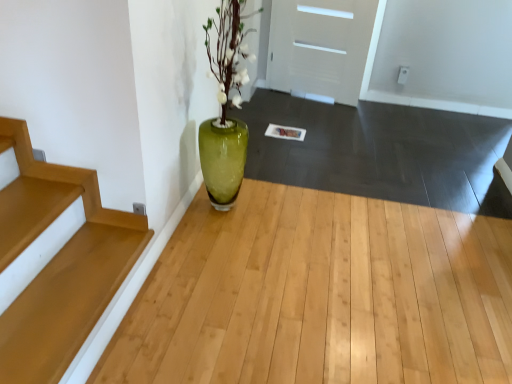
Where is `green glass vase at center`? The width and height of the screenshot is (512, 384). green glass vase at center is located at coordinates (320, 295).

Image resolution: width=512 pixels, height=384 pixels. What do you see at coordinates (320, 47) in the screenshot? I see `white matte door at upper center` at bounding box center [320, 47].

The width and height of the screenshot is (512, 384). I want to click on wooden stairs at lower left, so click(x=58, y=262).

How many degrees apart are the facing directions of wooden stairs at lower left and white matte door at upper center?

The facing directions of wooden stairs at lower left and white matte door at upper center are 113 degrees apart.

Based on their positions, is wooden stairs at lower left located to the left or right of white matte door at upper center?

Based on their positions, wooden stairs at lower left is located to the left of white matte door at upper center.

The width and height of the screenshot is (512, 384). I want to click on door behind the wooden stairs at lower left, so click(x=320, y=47).

Would you say wooden stairs at lower left is inside or outside white matte door at upper center?

wooden stairs at lower left is not inside white matte door at upper center, it's outside.

Consider the image. From a real-world perspective, is white matte door at upper center below green glass vase at center?

No.

Can green glass vase at center be found inside white matte door at upper center?

No, green glass vase at center is located outside of white matte door at upper center.

Can you confirm if white matte door at upper center is taller than green glass vase at center?

Correct, white matte door at upper center is much taller as green glass vase at center.

Considering the sizes of objects white matte door at upper center and green glass vase at center in the image provided, who is thinner, white matte door at upper center or green glass vase at center?

white matte door at upper center is thinner.

Can you tell me how much white matte door at upper center and wooden stairs at lower left differ in facing direction?

113 degrees.

Would you say wooden stairs at lower left is part of white matte door at upper center's contents?

No, wooden stairs at lower left is not a part of white matte door at upper center.

Are white matte door at upper center and wooden stairs at lower left making contact?

No, white matte door at upper center is not touching wooden stairs at lower left.

Considering the relative positions of white matte door at upper center and wooden stairs at lower left in the image provided, is white matte door at upper center to the left or to the right of wooden stairs at lower left?

white matte door at upper center is positioned on wooden stairs at lower left's right side.

Relative to wooden stairs at lower left, is green glass vase at center in front or behind?

green glass vase at center is positioned closer to the viewer than wooden stairs at lower left.

Can you confirm if green glass vase at center is positioned to the right of wooden stairs at lower left?

Yes, green glass vase at center is to the right of wooden stairs at lower left.

Which is farther, (441, 328) or (86, 209)?

Positioned behind is point (86, 209).

Choose the correct answer: Is green glass vase at center inside wooden stairs at lower left or outside it?

green glass vase at center lies outside wooden stairs at lower left.

In the image, is wooden stairs at lower left on the left side or the right side of green glass vase at center?

wooden stairs at lower left is to the left of green glass vase at center.

Looking at this image, from a real-world perspective, is wooden stairs at lower left positioned under green glass vase at center based on gravity?

No, from a real-world perspective, wooden stairs at lower left is not under green glass vase at center.

Considering the positions of points (99, 311) and (199, 363), is point (99, 311) closer to camera compared to point (199, 363)?

Yes, it is.

Who is smaller, wooden stairs at lower left or green glass vase at center?

wooden stairs at lower left is smaller.

Is green glass vase at center looking in the opposite direction of white matte door at upper center?

No, white matte door at upper center is not at the back of green glass vase at center.

Can you confirm if green glass vase at center is taller than white matte door at upper center?

No.

Measure the distance between green glass vase at center and white matte door at upper center.

A distance of 7.05 feet exists between green glass vase at center and white matte door at upper center.

Considering the relative sizes of green glass vase at center and white matte door at upper center in the image provided, is green glass vase at center smaller than white matte door at upper center?

Actually, green glass vase at center might be larger than white matte door at upper center.

Find the location of `stairs below the white matte door at upper center (from the image's perspective)`. stairs below the white matte door at upper center (from the image's perspective) is located at coordinates (58, 262).

This screenshot has height=384, width=512. I want to click on door behind the green glass vase at center, so click(320, 47).

Considering their positions, is white matte door at upper center positioned further to wooden stairs at lower left than green glass vase at center?

Among the two, white matte door at upper center is located further to wooden stairs at lower left.

Estimate the real-world distances between objects in this image. Which object is further from white matte door at upper center, green glass vase at center or wooden stairs at lower left?

wooden stairs at lower left.

Which object lies nearer to the anchor point white matte door at upper center, wooden stairs at lower left or green glass vase at center?

green glass vase at center is closer to white matte door at upper center.

Estimate the real-world distances between objects in this image. Which object is further from green glass vase at center, white matte door at upper center or wooden stairs at lower left?

white matte door at upper center lies further to green glass vase at center than the other object.

Looking at the image, which one is located closer to green glass vase at center, wooden stairs at lower left or white matte door at upper center?

The object closer to green glass vase at center is wooden stairs at lower left.

Considering their positions, is green glass vase at center positioned closer to wooden stairs at lower left than white matte door at upper center?

Based on the image, green glass vase at center appears to be nearer to wooden stairs at lower left.

Find the location of a particular element. stairs located between green glass vase at center and white matte door at upper center in the depth direction is located at coordinates tap(58, 262).